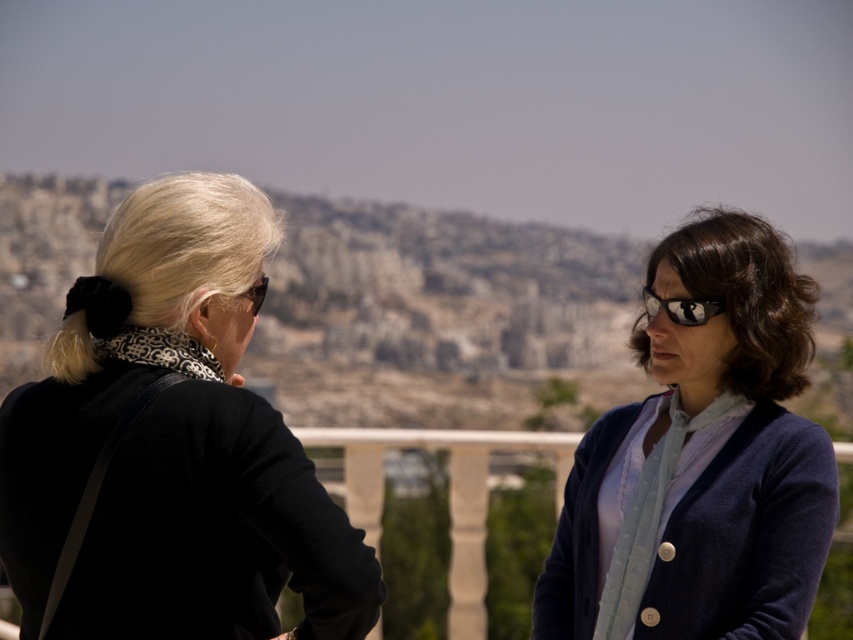
You are a photographer trying to capture a landscape photo of the desert hills in the background. You have a camera with a wide lens that requires a minimum distance of 2 meters between the camera and the subject to focus properly. You are currently holding the camera and facing the two people in the scene. The black matte jacket at upper left is closer to you than the matte black goggles at right. Can you take the photo without moving closer than 2 meters to the subjects?

The black matte jacket at upper left is closer to you than the matte black goggles at right. Since the camera requires a minimum distance of 2 meters to focus, you need to ensure that the closest subject, which is the black matte jacket at upper left, is at least 2 meters away. If the jacket is within 2 meters, the camera won questioned. If it is farther than 2 meters, then you can take the photo without moving closer.

Looking at this image, you are standing in the desert and see two people. The person on the left is wearing a black jacket, and the person on the right is wearing a light blue cardigan at right. Which person is closer to the point at coordinates (701, 460)?

The blue cardigan at right is located at point (701, 460), so the person on the right wearing the blue cardigan at right is exactly at that coordinate.

You are standing in the desert landscape and want to reach the point marked at coordinates (265, 444). If you walk directly towards it, how far will you have to walk?

The point at coordinates (265, 444) is 364.22 meters away from the viewer, so you will have to walk 364.22 meters to reach it.